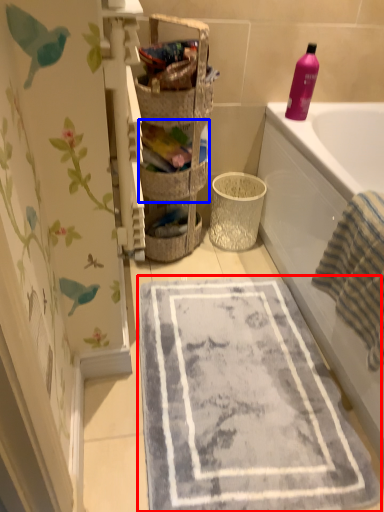
Question: Which of the following is the closest to the observer, bath mat (highlighted by a red box) or basket (highlighted by a blue box)?

Choices:
 (A) bath mat
 (B) basket

Answer: (A)